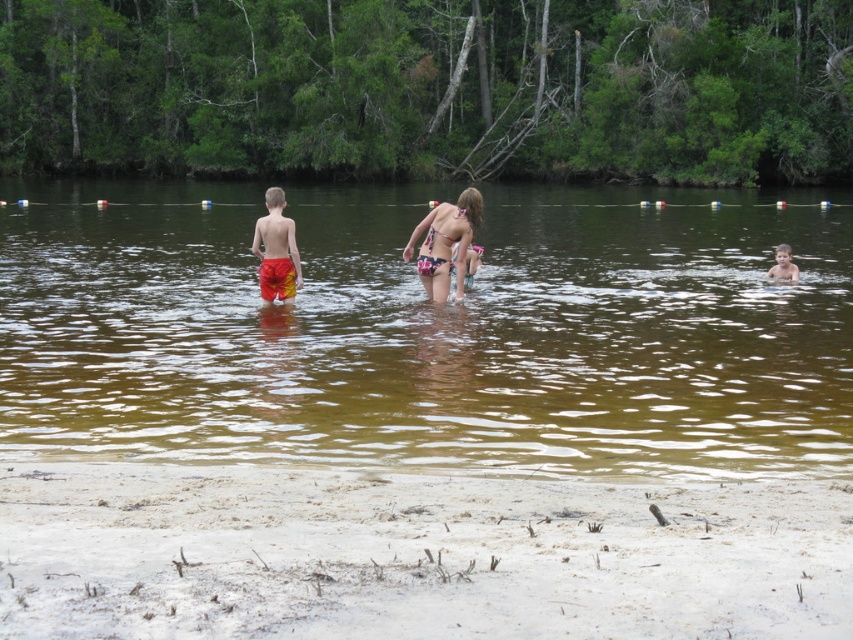
Is brown murky water at center shorter than smooth skin boy at right?

No.

Does point (653, 241) come behind point (795, 268)?

Yes, point (653, 241) is farther from viewer.

Identify the location of brown murky water at center. This screenshot has height=640, width=853. (428, 332).

Does red/yellow shorts at center have a lesser height compared to smooth skin boy at right?

Incorrect, red/yellow shorts at center's height does not fall short of smooth skin boy at right's.

Which of these two, red/yellow shorts at center or smooth skin boy at right, stands shorter?

With less height is smooth skin boy at right.

Is point (297, 253) in front of point (779, 259)?

Yes, it is in front of point (779, 259).

Find the location of a particular element. red/yellow shorts at center is located at coordinates (276, 250).

Who is positioned more to the left, printed bikini at center or smooth skin boy at right?

printed bikini at center is more to the left.

Which is behind, point (474, 220) or point (782, 248)?

Positioned behind is point (782, 248).

At what (x,y) coordinates should I click in order to perform the action: click on printed bikini at center. Please return your answer as a coordinate pair (x, y). Looking at the image, I should click on (445, 243).